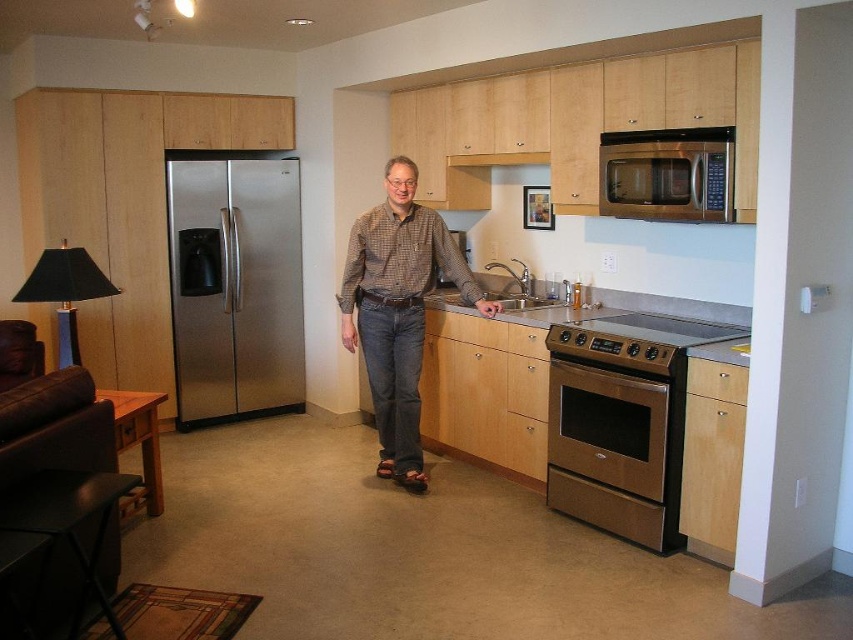
You are a delivery person who needs to place a small package on the counter between the brown checkered shirt at center and the stainless steel microwave at upper right. The package is 2 feet long. Is there enough space between them to place the package?

The distance between the brown checkered shirt at center and the stainless steel microwave at upper right is 3.74 feet. Since the package is 2 feet long, there is enough space to place it between them.

What object is located at the coordinates point (235,285) in the scene?

The point (235,285) marks the location of the stainless steel refrigerator at left.